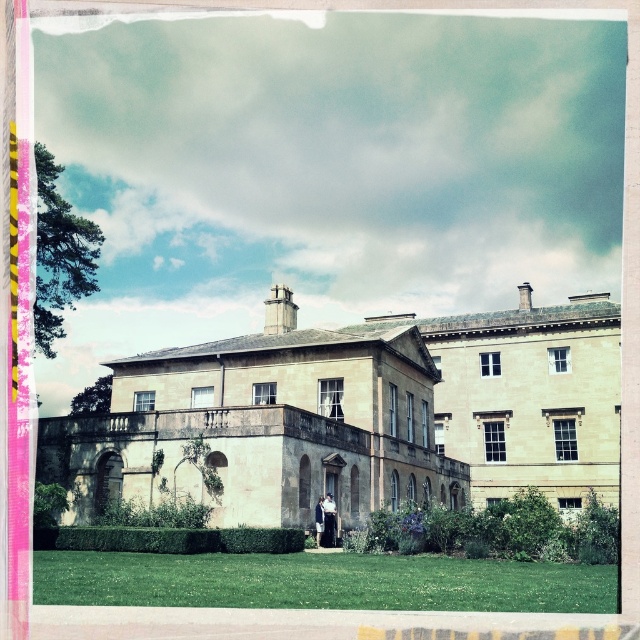
Which is in front, point (180, 438) or point (321, 536)?

Positioned in front is point (180, 438).

Is beige stone mansion at center smaller than dark blue jacket at center?

Actually, beige stone mansion at center might be larger than dark blue jacket at center.

Which is in front, point (180, 406) or point (321, 532)?

Positioned in front is point (321, 532).

At what (x,y) coordinates should I click in order to perform the action: click on beige stone mansion at center. Please return your answer as a coordinate pair (x, y). Image resolution: width=640 pixels, height=640 pixels. Looking at the image, I should click on (355, 417).

Measure the distance between point (x=173, y=384) and camera.

81.42 meters

Who is shorter, beige stone mansion at center or light blue fabric coat at center?

light blue fabric coat at center

Identify the location of beige stone mansion at center. This screenshot has width=640, height=640. (355, 417).

Which of these two, green grass at lower center or dark blue jacket at center, stands shorter?

dark blue jacket at center is shorter.

Is green grass at lower center positioned before dark blue jacket at center?

Yes, green grass at lower center is closer to the viewer.

Is point (168, 554) behind point (321, 528)?

No, it is in front of (321, 528).

This screenshot has height=640, width=640. I want to click on green grass at lower center, so click(321, 580).